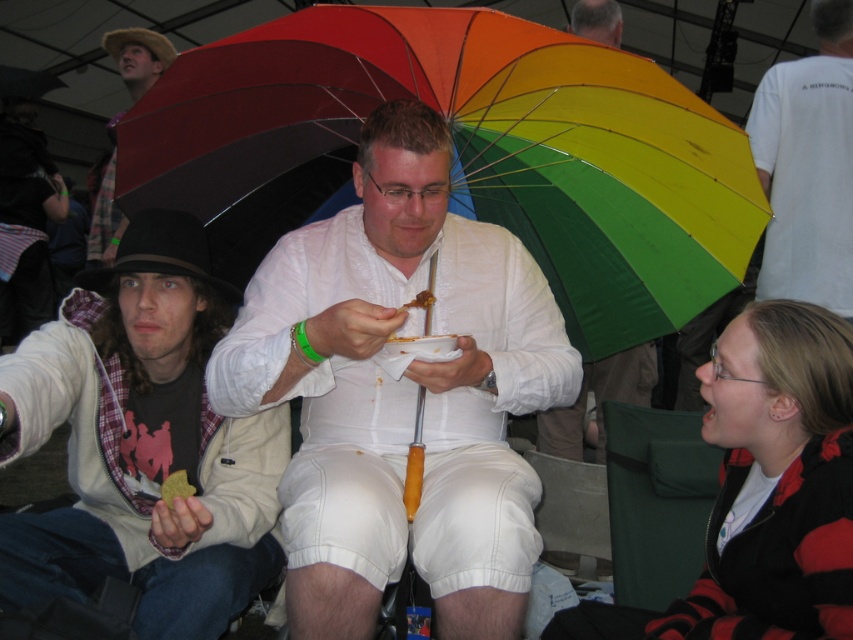
Question: Estimate the real-world distances between objects in this image. Which object is farther from the white matte shirt at center?

Choices:
 (A) matte brown hat at upper left
 (B) brown crumbly at center

Answer: (A)

Question: Is matte brown hat at upper left wider than brown crumbly at center?

Choices:
 (A) yes
 (B) no

Answer: (A)

Question: Which point is closer to the camera?

Choices:
 (A) white t-shirt at upper center
 (B) matte black hat at left

Answer: (B)

Question: Which object is positioned farthest from the white matte shirt at center?

Choices:
 (A) matte black hat at left
 (B) brown crumbly at center
 (C) matte brown hat at upper left

Answer: (C)

Question: From the image, what is the correct spatial relationship of gray hair at upper center in relation to green crumbly food at lower left?

Choices:
 (A) above
 (B) below

Answer: (A)

Question: Can you confirm if white matte shirt at center is positioned to the right of green crumbly food at lower left?

Choices:
 (A) yes
 (B) no

Answer: (A)